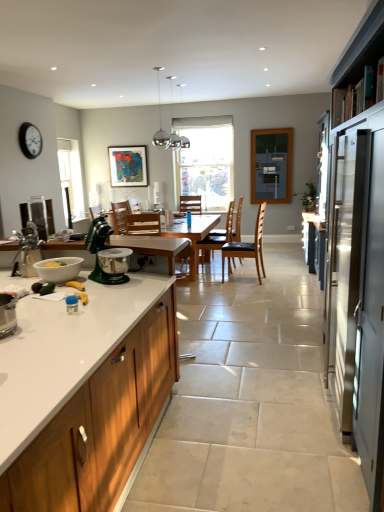
Question: Can you confirm if wooden table at center is taller than blue glass window screen at upper center?

Choices:
 (A) yes
 (B) no

Answer: (B)

Question: From a real-world perspective, is wooden table at center located beneath blue glass window screen at upper center?

Choices:
 (A) yes
 (B) no

Answer: (A)

Question: Is wooden table at center smaller than blue glass window screen at upper center?

Choices:
 (A) yes
 (B) no

Answer: (B)

Question: Does wooden table at center lie behind blue glass window screen at upper center?

Choices:
 (A) no
 (B) yes

Answer: (A)

Question: Is wooden table at center closer to camera compared to blue glass window screen at upper center?

Choices:
 (A) yes
 (B) no

Answer: (A)

Question: From a real-world perspective, is satin silver refrigerator at right above or below wooden chair at center, arranged as the fourth chair when viewed from the front?

Choices:
 (A) above
 (B) below

Answer: (B)

Question: Is satin silver refrigerator at right wider or thinner than wooden chair at center, arranged as the fourth chair when viewed from the front?

Choices:
 (A) thin
 (B) wide

Answer: (A)

Question: In the image, is satin silver refrigerator at right positioned in front of or behind wooden chair at center, which is counted as the 1th chair, starting from the back?

Choices:
 (A) front
 (B) behind

Answer: (A)

Question: In terms of height, does satin silver refrigerator at right look taller or shorter compared to wooden chair at center, arranged as the fourth chair when viewed from the front?

Choices:
 (A) short
 (B) tall

Answer: (B)

Question: Considering the positions of point 129,338 and point 145,180, is point 129,338 closer or farther from the camera than point 145,180?

Choices:
 (A) farther
 (B) closer

Answer: (B)

Question: Would you say wooden cabinet at left is inside or outside matte wooden picture frame at upper center?

Choices:
 (A) outside
 (B) inside

Answer: (A)

Question: In terms of height, does wooden cabinet at left look taller or shorter compared to matte wooden picture frame at upper center?

Choices:
 (A) short
 (B) tall

Answer: (B)

Question: From a real-world perspective, is wooden cabinet at left physically located above or below matte wooden picture frame at upper center?

Choices:
 (A) below
 (B) above

Answer: (A)

Question: Looking at the image, does white glossy mixing bowl at lower left seem bigger or smaller compared to matte wooden picture frame at upper center?

Choices:
 (A) small
 (B) big

Answer: (A)

Question: From a real-world perspective, is white glossy mixing bowl at lower left above or below matte wooden picture frame at upper center?

Choices:
 (A) below
 (B) above

Answer: (A)